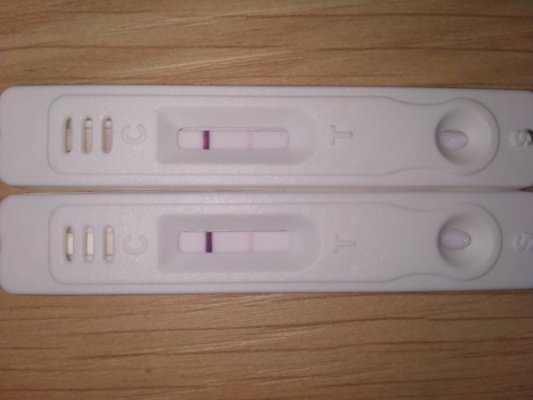
Identify the location of table. The height and width of the screenshot is (400, 533). (213, 353).